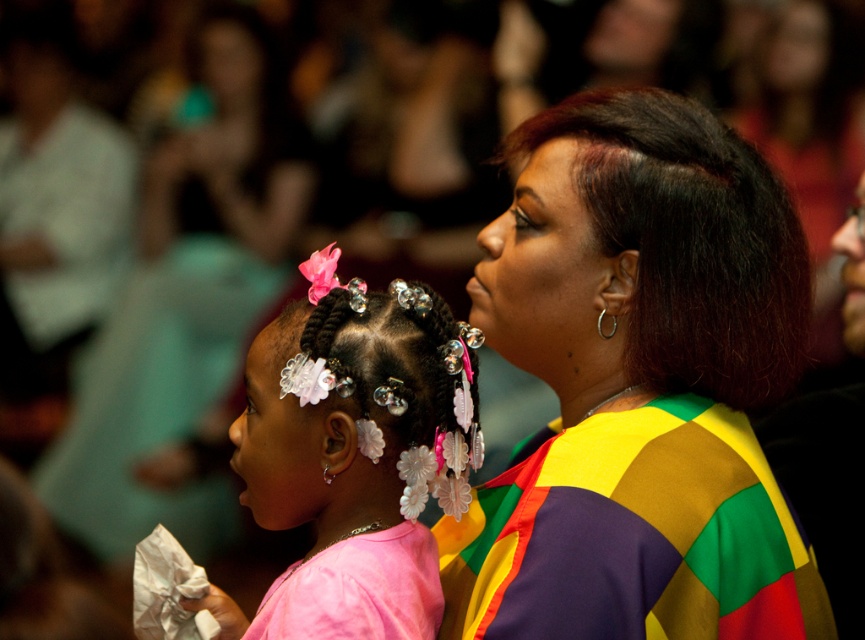
Does multicolored fabric at center appear over pink satin dress at lower left?

Yes.

Can you confirm if multicolored fabric at center is taller than pink satin dress at lower left?

Yes, multicolored fabric at center is taller than pink satin dress at lower left.

Is point (556, 624) positioned after point (295, 566)?

No, it is not.

Find the location of `multicolored fabric at center`. multicolored fabric at center is located at coordinates (638, 387).

Can you confirm if dark glossy hair at center is positioned below pink satin dress at lower left?

Actually, dark glossy hair at center is above pink satin dress at lower left.

Is point (760, 180) farther from camera compared to point (292, 616)?

That is True.

Who is more forward, (798, 332) or (399, 560)?

Point (399, 560) is in front.

This screenshot has height=640, width=865. I want to click on dark glossy hair at center, so click(x=689, y=241).

Which is in front, point (799, 552) or point (678, 148)?

Point (799, 552)

Which is behind, point (721, 525) or point (759, 285)?

The point (759, 285) is behind.

Describe the element at coordinates (633, 536) in the screenshot. The height and width of the screenshot is (640, 865). I see `multicolored fabric dress at center` at that location.

This screenshot has height=640, width=865. What are the coordinates of `multicolored fabric dress at center` in the screenshot? It's located at (633, 536).